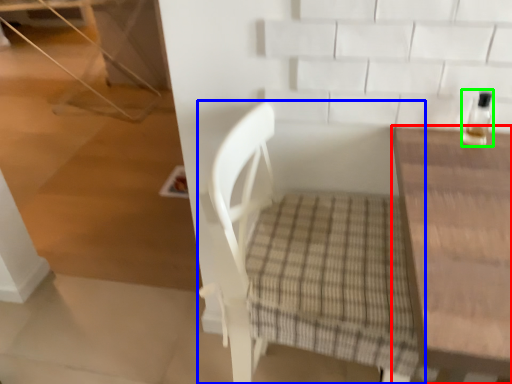
Question: Estimate the real-world distances between objects in this image. Which object is closer to table (highlighted by a red box), chair (highlighted by a blue box) or bottle (highlighted by a green box)?

Choices:
 (A) chair
 (B) bottle

Answer: (B)